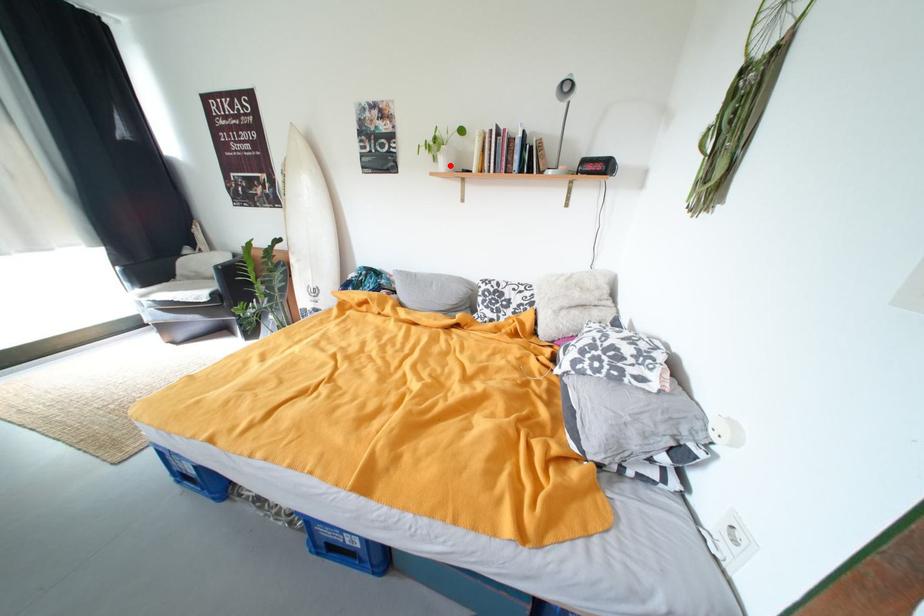
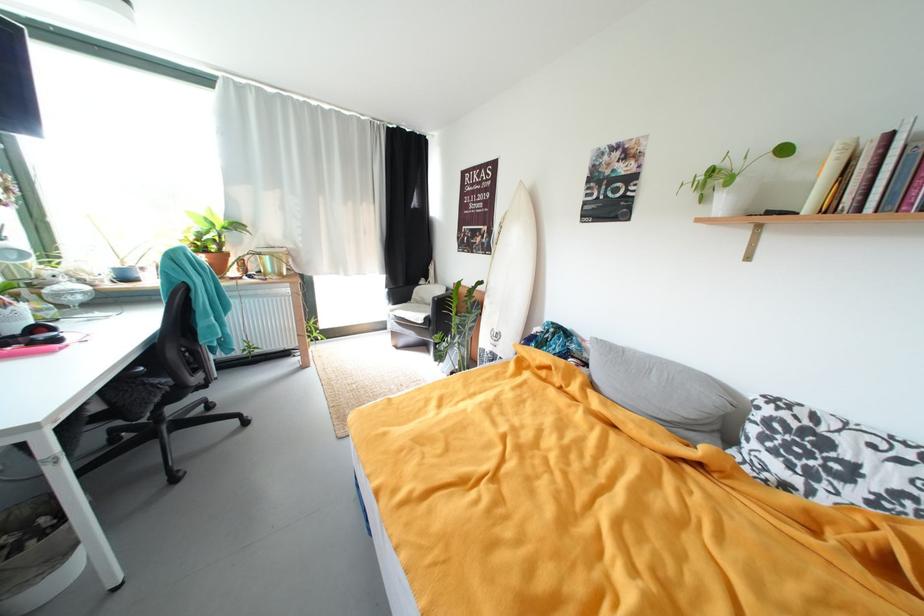
Locate, in the second image, the point that corresponds to the highlighted location in the first image.

(730, 206)